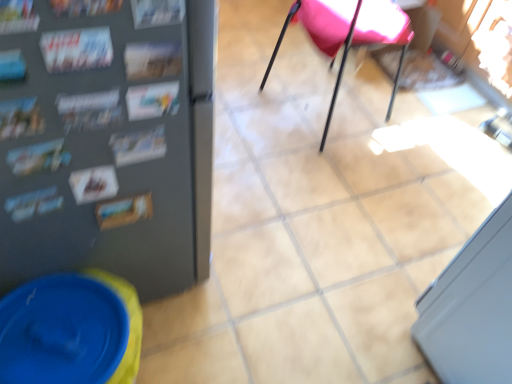
Where is `vacant space behind pink fabric chair at center`? This screenshot has height=384, width=512. vacant space behind pink fabric chair at center is located at coordinates (296, 54).